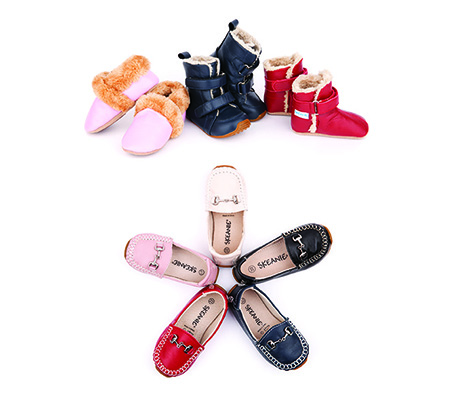
Where is `slipper or boot in the top area`? The image size is (450, 400). slipper or boot in the top area is located at coordinates (119, 98), (159, 110), (207, 88), (238, 58), (283, 88), (318, 111).